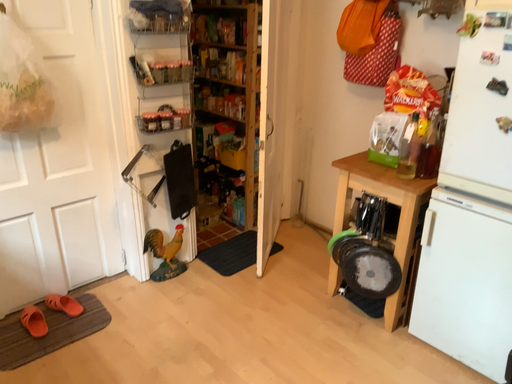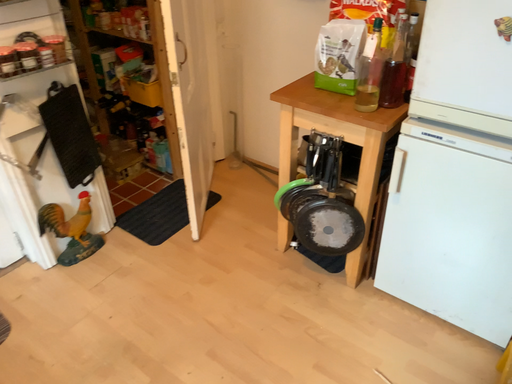
Question: Which way did the camera rotate in the video?

Choices:
 (A) rotated upward
 (B) rotated downward

Answer: (B)